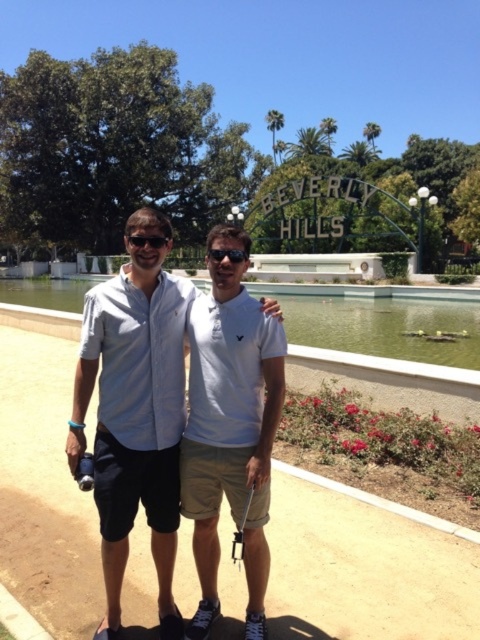
Does green glass pond at center appear on the right side of matte black sunglasses at center?

No, green glass pond at center is not to the right of matte black sunglasses at center.

Which is behind, point (7, 291) or point (167, 243)?

Positioned behind is point (7, 291).

Where is `green glass pond at center`? Image resolution: width=480 pixels, height=640 pixels. green glass pond at center is located at coordinates (382, 324).

This screenshot has height=640, width=480. What are the coordinates of `green glass pond at center` in the screenshot? It's located at (382, 324).

Does white cotton shirt at center have a smaller size compared to green glass pond at center?

Yes.

In the scene shown: Which is more to the left, white cotton shirt at center or green glass pond at center?

green glass pond at center

Does point (168, 396) lie behind point (382, 333)?

No.

At what (x,y) coordinates should I click in order to perform the action: click on white cotton shirt at center. Please return your answer as a coordinate pair (x, y). Looking at the image, I should click on (134, 412).

Can you confirm if green glass pond at center is bigger than matte black goggles at center?

Yes, green glass pond at center is bigger than matte black goggles at center.

Between green glass pond at center and matte black goggles at center, which one is positioned lower?

matte black goggles at center

Where is `green glass pond at center`? green glass pond at center is located at coordinates (382, 324).

The image size is (480, 640). What are the coordinates of `green glass pond at center` in the screenshot? It's located at (382, 324).